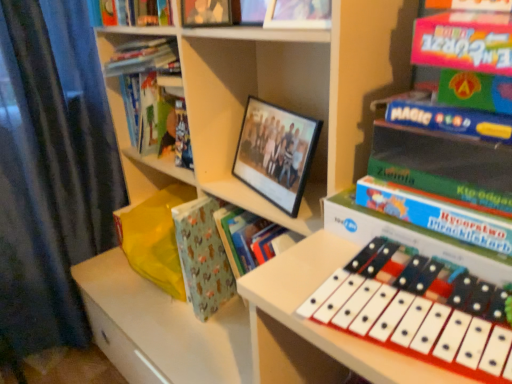
Question: From the image's perspective, does matte black photo frame at upper center, the 3th book from the right, appear higher than patterned paper at center?

Choices:
 (A) yes
 (B) no

Answer: (A)

Question: Is matte black photo frame at upper center, the second book in the left-to-right sequence, facing towards patterned paper at center?

Choices:
 (A) yes
 (B) no

Answer: (B)

Question: Is the depth of matte black photo frame at upper center, the second book in the left-to-right sequence, greater than that of patterned paper at center?

Choices:
 (A) yes
 (B) no

Answer: (B)

Question: Does matte black photo frame at upper center, which appears as the third book when viewed from the front, have a larger size compared to patterned paper at center?

Choices:
 (A) no
 (B) yes

Answer: (A)

Question: Is matte black photo frame at upper center, the 3th book from the right, outside of patterned paper at center?

Choices:
 (A) no
 (B) yes

Answer: (B)

Question: From a real-world perspective, does matte black photo frame at upper center, the 3th book from the right, sit lower than patterned paper at center?

Choices:
 (A) yes
 (B) no

Answer: (B)

Question: Could matte black photo frame at upper center, the second book in the left-to-right sequence, be considered to be inside hardcover book at upper left, the 4th book from the right?

Choices:
 (A) yes
 (B) no

Answer: (B)

Question: Is hardcover book at upper left, which is counted as the first book, starting from the left, closer to camera compared to matte black photo frame at upper center, the second book in the left-to-right sequence?

Choices:
 (A) no
 (B) yes

Answer: (A)

Question: Can you confirm if hardcover book at upper left, the 1th book from the back, is thinner than matte black photo frame at upper center, the 3th book from the right?

Choices:
 (A) no
 (B) yes

Answer: (A)

Question: Are hardcover book at upper left, the 1th book from the back, and matte black photo frame at upper center, the 3th book from the right, far apart?

Choices:
 (A) yes
 (B) no

Answer: (B)

Question: Considering the relative sizes of hardcover book at upper left, marked as the fourth book in a front-to-back arrangement, and matte black photo frame at upper center, which appears as the third book when viewed from the front, in the image provided, is hardcover book at upper left, marked as the fourth book in a front-to-back arrangement, smaller than matte black photo frame at upper center, which appears as the third book when viewed from the front,?

Choices:
 (A) yes
 (B) no

Answer: (B)

Question: Is hardcover book at upper left, the 4th book from the right, to the left of matte black photo frame at upper center, which ranks as the 2th book in back-to-front order, from the viewer's perspective?

Choices:
 (A) no
 (B) yes

Answer: (B)

Question: Is matte black photo frame at upper center, the 3th book from the right, far away from black matte picture frame at center?

Choices:
 (A) no
 (B) yes

Answer: (A)